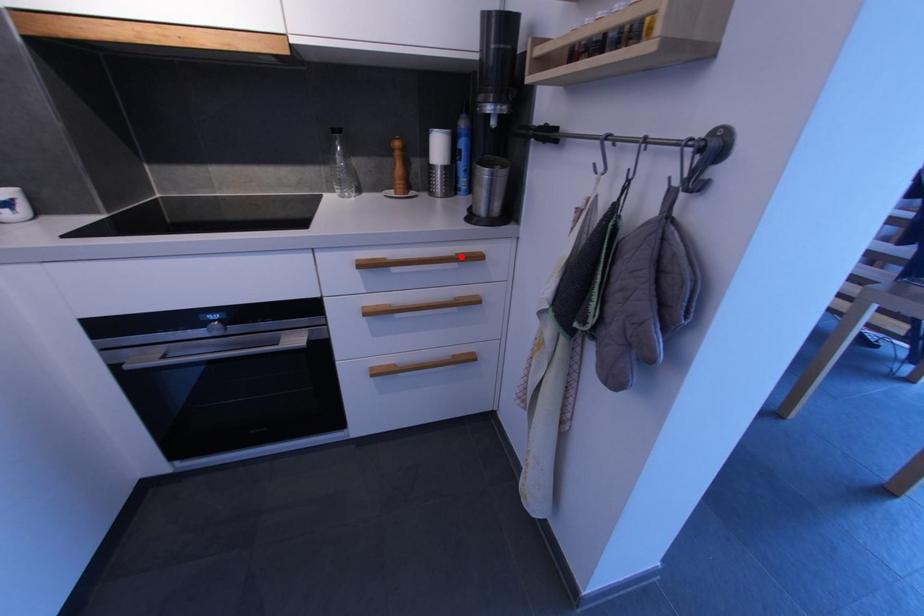
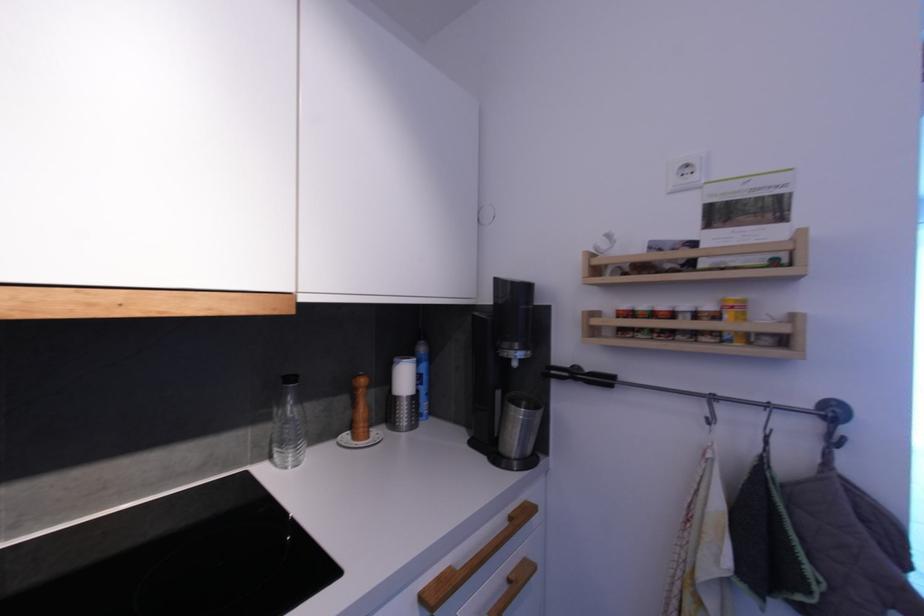
Question: I am providing you with two images of the same scene from different viewpoints. A red point is marked on the first image. Is the red point's position out of view in image 2?

Choices:
 (A) Yes
 (B) No

Answer: (B)